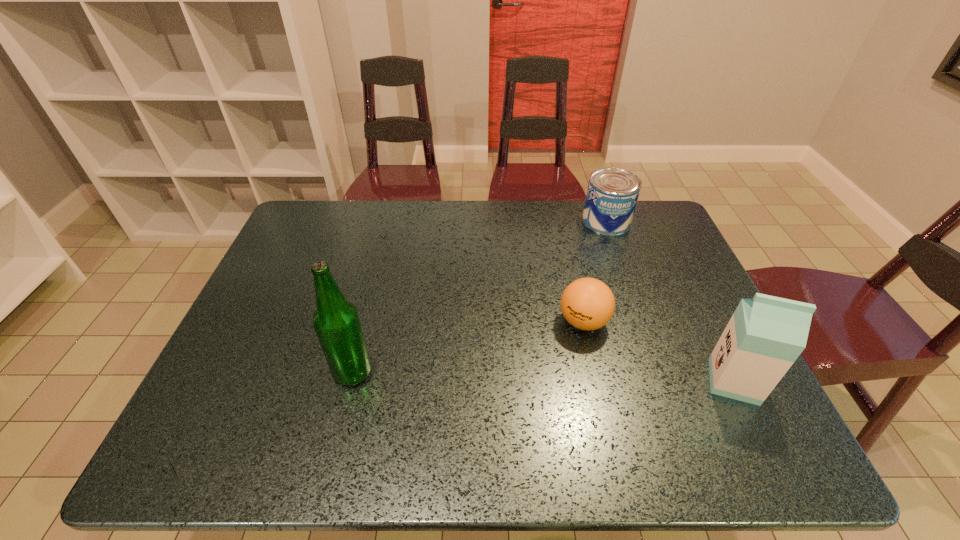
I want to click on vacant space on the desktop that is between the beer bottle and the rightmost object and is positioned on the front label of the third object from left to right, so click(x=550, y=377).

Image resolution: width=960 pixels, height=540 pixels. Identify the location of free space on the desktop that is between the leftmost object and the third shortest object and is positioned on the side with brand of the ping-pong ball. (502, 376).